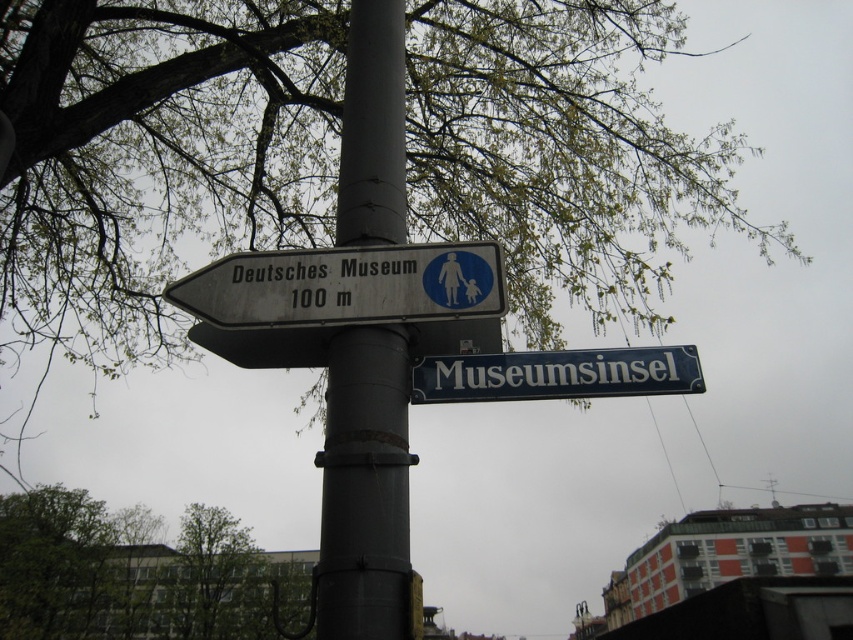
Does green leafy tree at upper left come behind white plastic sign at center?

Yes.

Is point (120, 349) closer to viewer compared to point (474, 355)?

That is False.

You are a GUI agent. You are given a task and a screenshot of the screen. Output one action in this format:
    pyautogui.click(x=<x>, y=<y>)
    Task: Click on the green leafy tree at upper left
    The height and width of the screenshot is (640, 853).
    Given the screenshot: What is the action you would take?
    pyautogui.click(x=154, y=161)

Is metallic pole at center positioned at the back of white metallic sign at upper left?

That is True.

Does point (372, 344) come behind point (393, 257)?

No, (372, 344) is closer to viewer.

Measure the distance between metallic pole at center and camera.

metallic pole at center and camera are 4.30 meters apart from each other.

The width and height of the screenshot is (853, 640). Identify the location of metallic pole at center. point(364,488).

From the picture: Is white metallic sign at upper left wider than white plastic sign at center?

Indeed, white metallic sign at upper left has a greater width compared to white plastic sign at center.

Can you confirm if white metallic sign at upper left is taller than white plastic sign at center?

Yes.

Measure the distance between white metallic sign at upper left and camera.

white metallic sign at upper left is 3.93 meters away from camera.

This screenshot has height=640, width=853. In order to click on white metallic sign at upper left in this screenshot , I will do `click(345, 285)`.